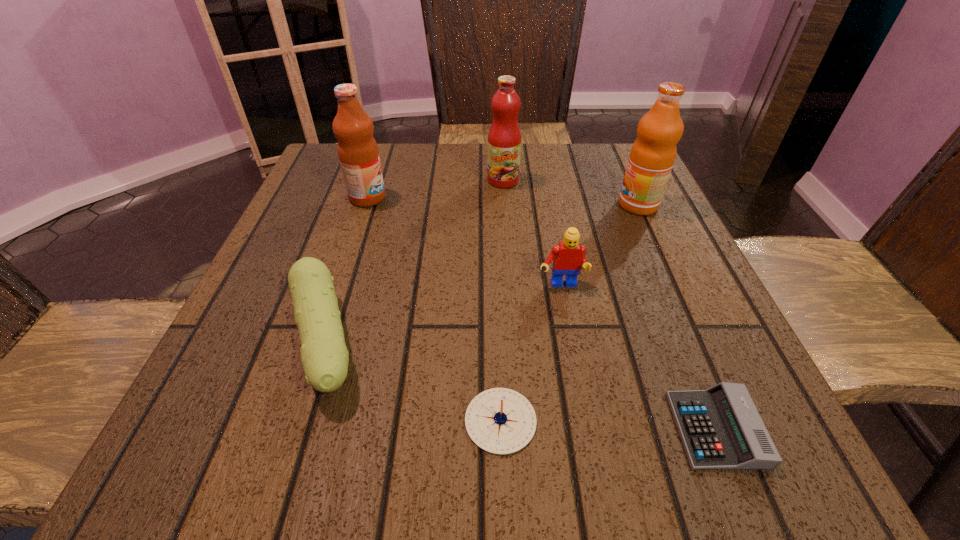
What are the coordinates of `free space that satisfies the following two spatial constraints: 1. on the label side of the rightmost fruit juice; 2. on the front-facing side of the third object from right to left` in the screenshot? It's located at (674, 286).